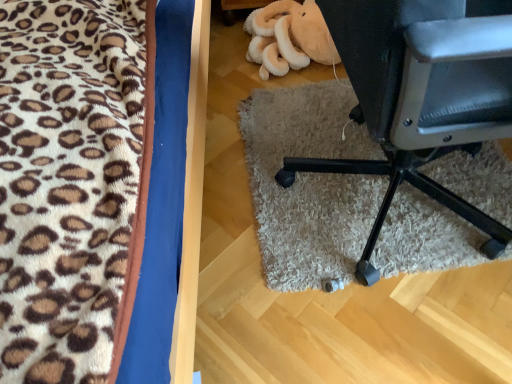
Question: Is soft plush toy at upper center taller or shorter than fluffy leopard print blanket at left?

Choices:
 (A) tall
 (B) short

Answer: (B)

Question: Considering their positions, is soft plush toy at upper center located in front of or behind fluffy leopard print blanket at left?

Choices:
 (A) front
 (B) behind

Answer: (B)

Question: Considering the real-world distances, which object is closest to the fluffy leopard print blanket at left?

Choices:
 (A) black leather chair at lower right
 (B) soft plush toy at upper center

Answer: (A)

Question: Which of these objects is positioned closest to the soft plush toy at upper center?

Choices:
 (A) black leather chair at lower right
 (B) fluffy leopard print blanket at left

Answer: (A)